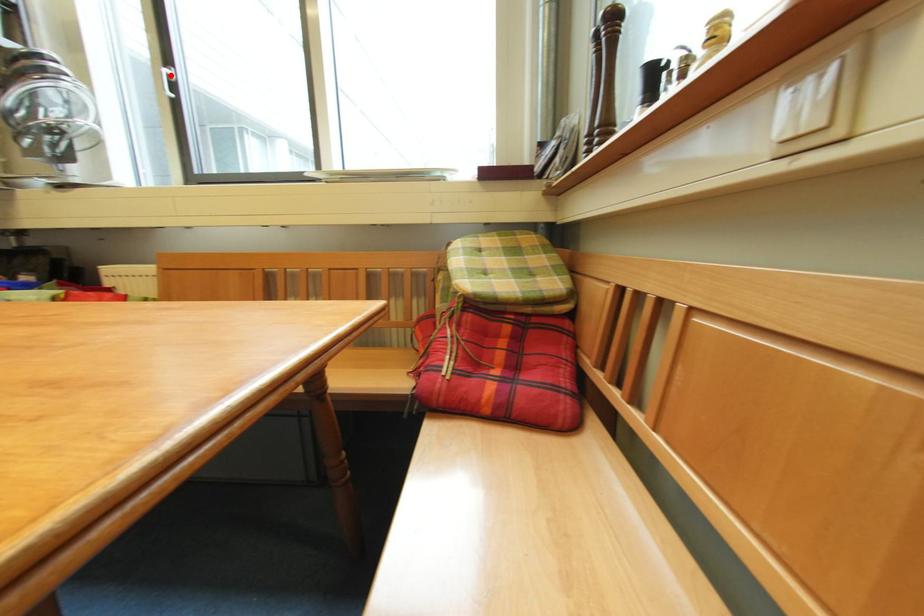
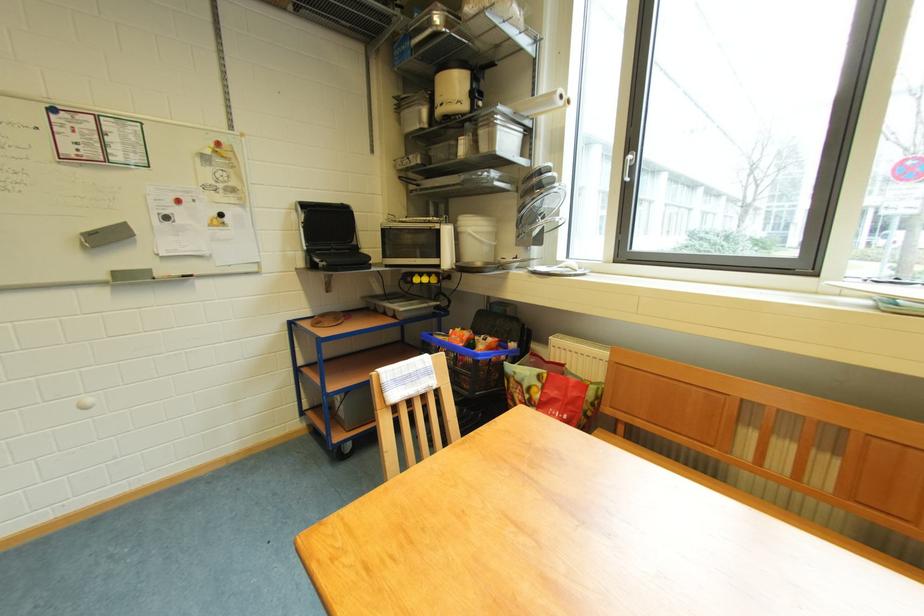
Question: A red point is marked in image1. In image2, is the corresponding 3D point closer to the camera or farther? Reply with the corresponding letter.

Choices:
 (A) The corresponding 3D point is closer.
 (B) The corresponding 3D point is farther.

Answer: (A)